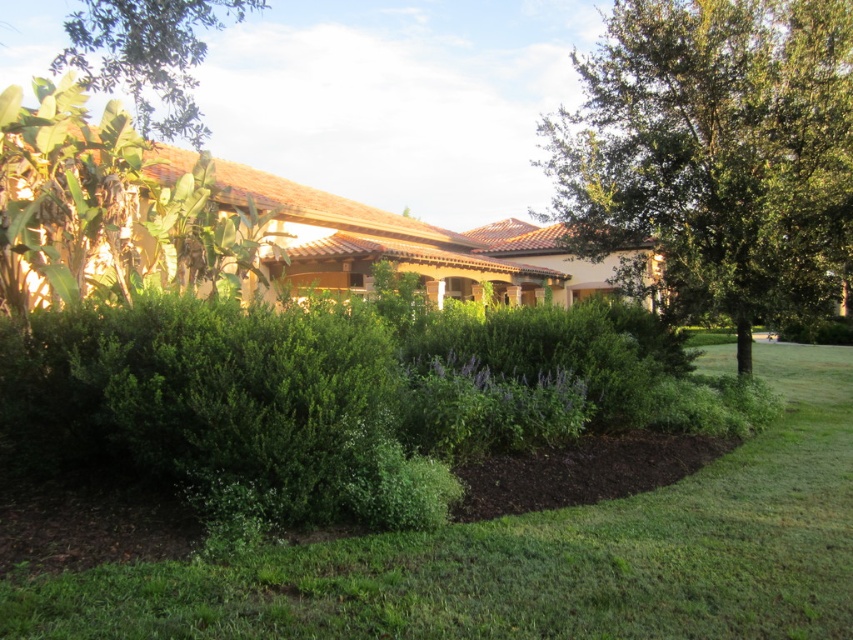
Does green grass at lower center have a greater height compared to green leafy tree at upper right?

No.

Does green grass at lower center appear under green leafy tree at upper right?

Yes.

Is point (282, 602) behind point (654, 104)?

No.

At what (x,y) coordinates should I click in order to perform the action: click on green grass at lower center. Please return your answer as a coordinate pair (x, y). Looking at the image, I should click on (538, 557).

Is green grass at lower center positioned before green leafy tree at upper left?

Yes.

Does green grass at lower center appear on the right side of green leafy tree at upper left?

Correct, you'll find green grass at lower center to the right of green leafy tree at upper left.

Does point (828, 356) lie behind point (80, 45)?

No, it is not.

At what (x,y) coordinates should I click in order to perform the action: click on green grass at lower center. Please return your answer as a coordinate pair (x, y). Looking at the image, I should click on (538, 557).

Which is above, green leafy tree at upper right or green leafy tree at upper left?

green leafy tree at upper left is above.

Which is more to the right, green leafy tree at upper right or green leafy tree at upper left?

Positioned to the right is green leafy tree at upper right.

Is point (668, 13) closer to camera compared to point (149, 10)?

No, it is behind (149, 10).

I want to click on green leafy tree at upper right, so click(717, 152).